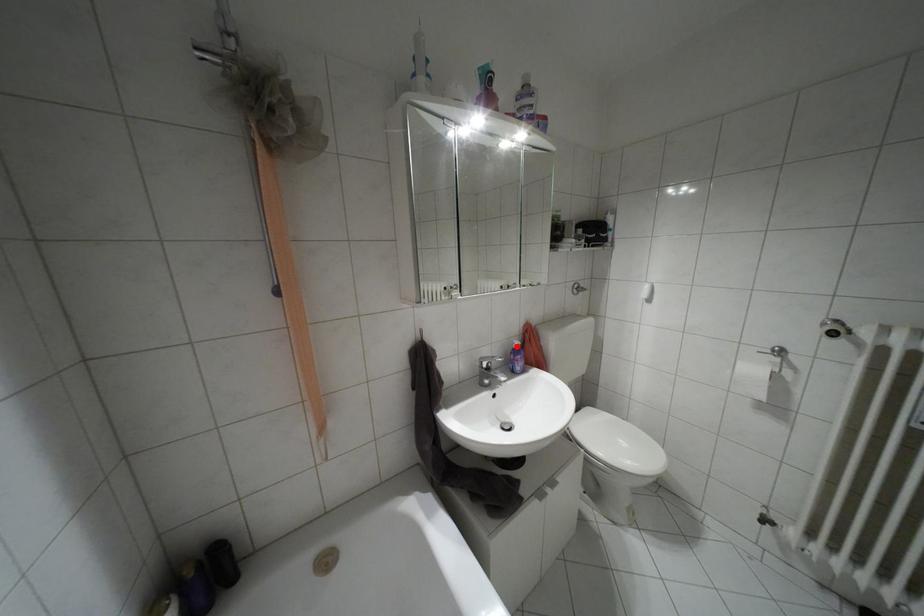
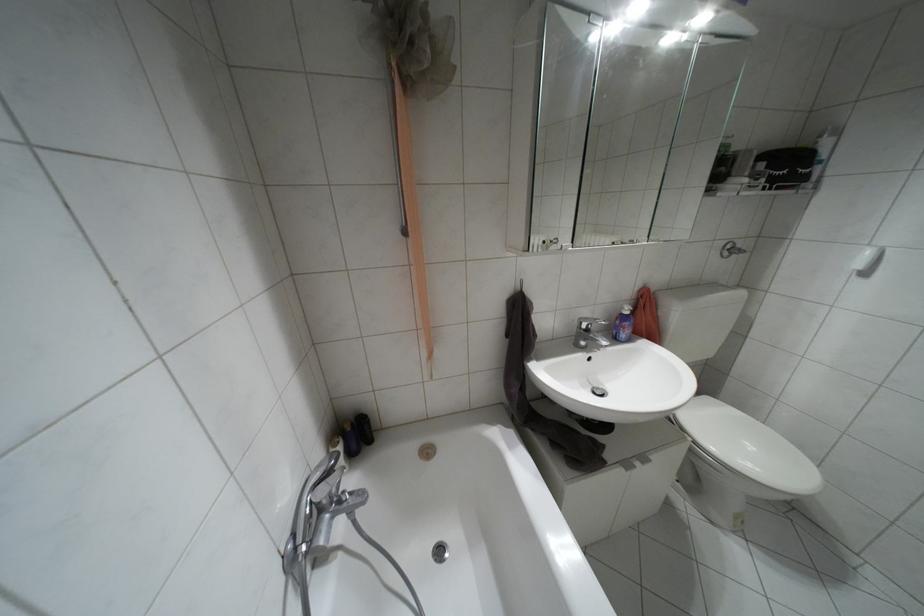
The point at the highlighted location is marked in the first image. Where is the corresponding point in the second image?

(626, 312)